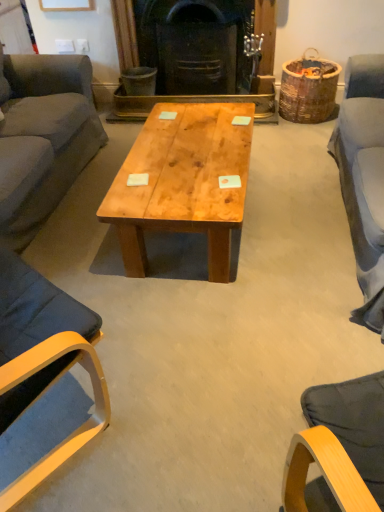
Question: Does matte wood chair at left have a smaller size compared to natural wood coffee table at center?

Choices:
 (A) no
 (B) yes

Answer: (A)

Question: Does matte wood chair at left have a lesser width compared to natural wood coffee table at center?

Choices:
 (A) no
 (B) yes

Answer: (B)

Question: From the image's perspective, is matte wood chair at left on natural wood coffee table at center?

Choices:
 (A) no
 (B) yes

Answer: (A)

Question: Does matte wood chair at left have a greater width compared to natural wood coffee table at center?

Choices:
 (A) yes
 (B) no

Answer: (B)

Question: Is matte wood chair at left facing towards natural wood coffee table at center?

Choices:
 (A) no
 (B) yes

Answer: (B)

Question: From the image's perspective, relative to dark gray fabric couch at left, is natural wood coffee table at center above or below?

Choices:
 (A) below
 (B) above

Answer: (A)

Question: In the image, is natural wood coffee table at center positioned in front of or behind dark gray fabric couch at left?

Choices:
 (A) front
 (B) behind

Answer: (B)

Question: Looking at the image, does natural wood coffee table at center seem bigger or smaller compared to dark gray fabric couch at left?

Choices:
 (A) big
 (B) small

Answer: (B)

Question: Considering the relative positions of natural wood coffee table at center and dark gray fabric couch at left in the image provided, is natural wood coffee table at center to the left or to the right of dark gray fabric couch at left?

Choices:
 (A) left
 (B) right

Answer: (B)

Question: Is dark gray fabric couch at left wider or thinner than black cast iron fireplace at center?

Choices:
 (A) wide
 (B) thin

Answer: (A)

Question: Is dark gray fabric couch at left situated inside black cast iron fireplace at center or outside?

Choices:
 (A) inside
 (B) outside

Answer: (B)

Question: In terms of height, does dark gray fabric couch at left look taller or shorter compared to black cast iron fireplace at center?

Choices:
 (A) tall
 (B) short

Answer: (A)

Question: From the image's perspective, is dark gray fabric couch at left positioned above or below black cast iron fireplace at center?

Choices:
 (A) below
 (B) above

Answer: (A)

Question: From the image's perspective, relative to natural wood coffee table at center, is black cast iron fireplace at center above or below?

Choices:
 (A) above
 (B) below

Answer: (A)

Question: From a real-world perspective, is black cast iron fireplace at center above or below natural wood coffee table at center?

Choices:
 (A) below
 (B) above

Answer: (B)